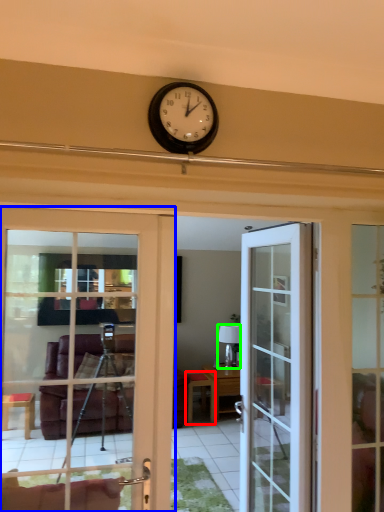
Question: Considering the real-world distances, which object is closest to table (highlighted by a red box)? door (highlighted by a blue box) or lamp (highlighted by a green box).

Choices:
 (A) door
 (B) lamp

Answer: (B)